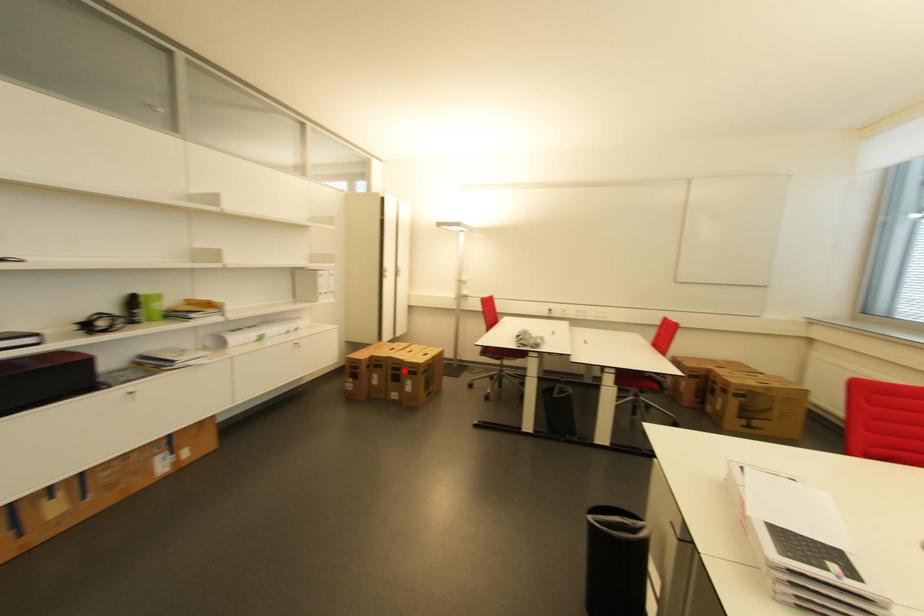
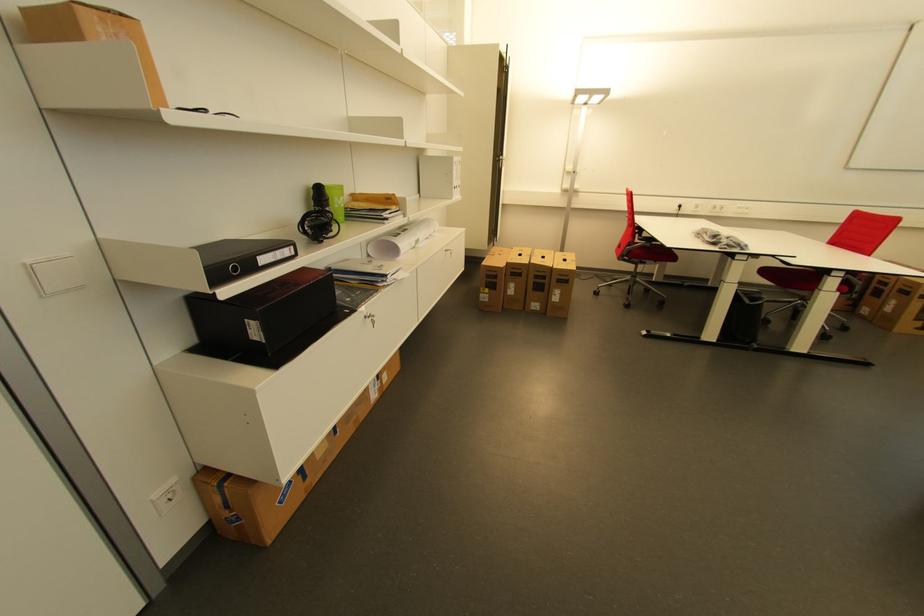
Question: I am providing you with two images of the same scene from different viewpoints. Given a red point in image1, look at the same physical point in image2. Is it:

Choices:
 (A) Closer to the viewpoint
 (B) Farther from the viewpoint

Answer: (A)